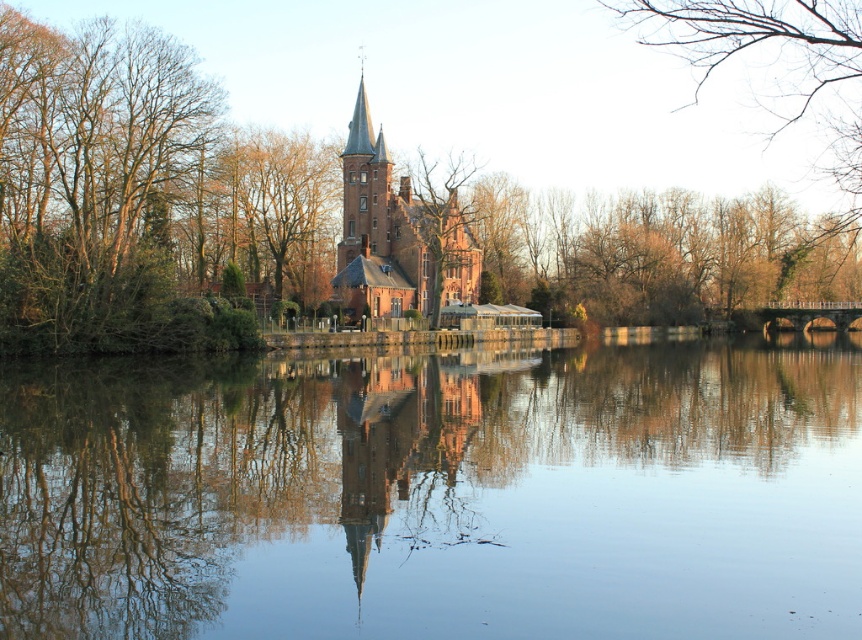
Question: Which object is positioned farthest from the brown leafless tree at left?

Choices:
 (A) smooth water at center
 (B) brick tower at center

Answer: (B)

Question: Estimate the real-world distances between objects in this image. Which object is closer to the brick tower at center?

Choices:
 (A) smooth water at center
 (B) brown leafless tree at left

Answer: (B)

Question: Is brown leafless tree at left further to the viewer compared to brick tower at center?

Choices:
 (A) yes
 (B) no

Answer: (B)

Question: Does brown leafless tree at left appear under brick tower at center?

Choices:
 (A) yes
 (B) no

Answer: (A)

Question: Where is smooth water at center located in relation to brown leafless tree at left in the image?

Choices:
 (A) left
 (B) right

Answer: (B)

Question: Which point is farther to the camera?

Choices:
 (A) (434, 323)
 (B) (61, 378)
 (C) (114, 180)

Answer: (A)